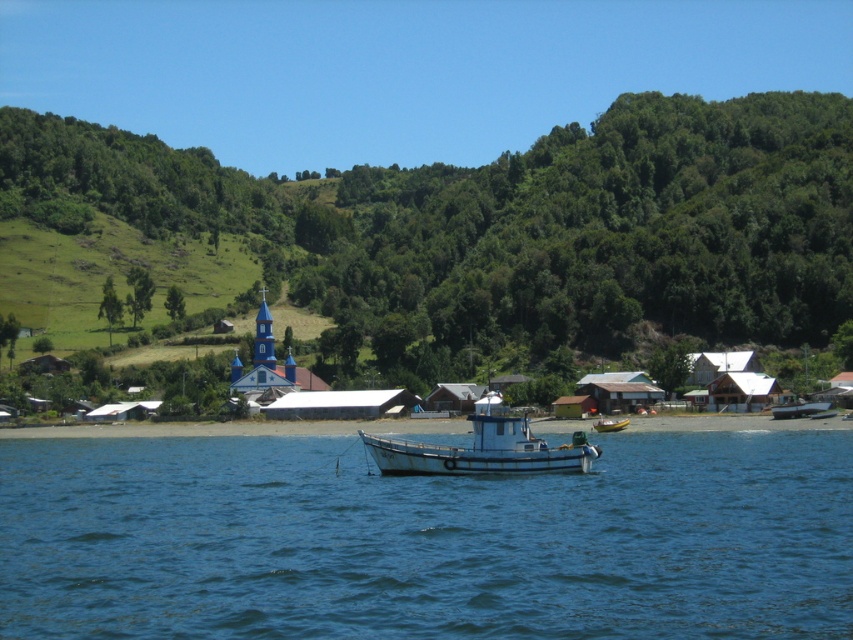
Who is more distant from viewer, (x=306, y=291) or (x=465, y=461)?

Positioned behind is point (x=306, y=291).

At what (x,y) coordinates should I click in order to perform the action: click on green grassy hillside at upper center. Please return your answer as a coordinate pair (x, y). The image size is (853, 640). Looking at the image, I should click on (520, 221).

Between point (300, 304) and point (567, 458), which one is positioned behind?

Point (300, 304)

Find the location of `green grassy hillside at upper center`. green grassy hillside at upper center is located at coordinates (520, 221).

Is white plastic boat at lower right positioned before yellow rubber boat at center?

No.

This screenshot has width=853, height=640. In order to click on white plastic boat at lower right in this screenshot , I will do `click(798, 408)`.

Does white matte boat at center come behind yellow rubber boat at center?

That is False.

I want to click on white matte boat at center, so click(x=485, y=449).

Image resolution: width=853 pixels, height=640 pixels. What are the coordinates of `white matte boat at center` in the screenshot? It's located at (485, 449).